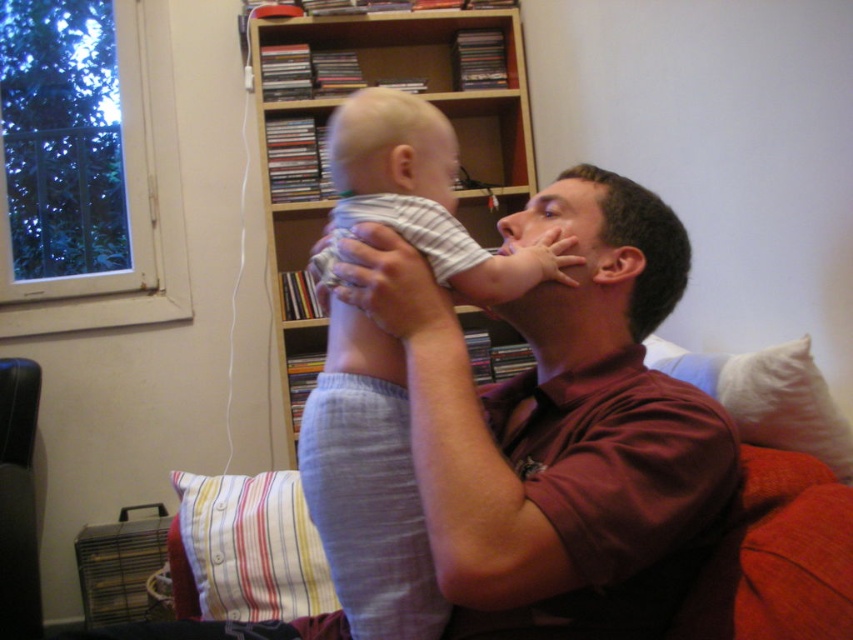
You are organizing a baby shower and need to arrange decorations. You have a striped cotton shirt at center and a striped fabric pillow at lower left. Which item should you place on the left side of the table to maintain symmetry?

The striped fabric pillow at lower left should be placed on the left side of the table since it is already positioned to the left of the striped cotton shirt at center in the original scene.

In the scene where an adult in a maroon shirt is holding a baby on a couch with red cushions, you notice a gray striped shirt at center and a white soft pillow at right. From the perspective of someone sitting on the couch, which object is closer to your left side?

The gray striped shirt at center is to the left of the white soft pillow at right, so the gray striped shirt at center would be closer to your left side when sitting on the couch.

You are standing in the living room and want to reach the point at coordinates (380, 484). If your arm can extend 30 inches, can you touch that point without moving your body?

The point at coordinates (380, 484) is 33.78 inches away from you. Since your arm can only extend 30 inches, you cannot reach it without moving your body.